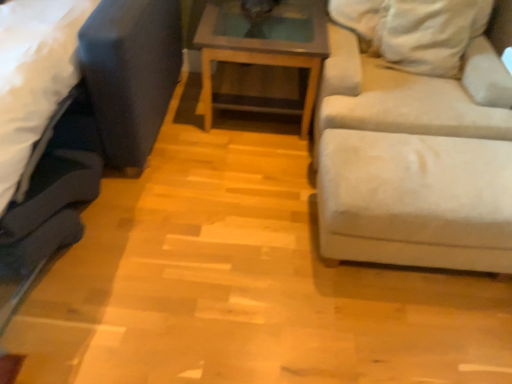
I want to click on velvet dark blue studio couch at left, the 2th studio couch positioned from the right, so click(x=93, y=134).

Where is `velvet dark blue studio couch at left, the 2th studio couch positioned from the right`? The height and width of the screenshot is (384, 512). velvet dark blue studio couch at left, the 2th studio couch positioned from the right is located at coordinates (93, 134).

From the image's perspective, is velvet dark blue studio couch at left, acting as the first studio couch starting from the left, located above or below beige fabric couch at right, positioned as the first studio couch in right-to-left order?

From the image's perspective, velvet dark blue studio couch at left, acting as the first studio couch starting from the left, appears below beige fabric couch at right, positioned as the first studio couch in right-to-left order.

Is velvet dark blue studio couch at left, the 2th studio couch positioned from the right, facing towards beige fabric couch at right, which is counted as the 2th studio couch, starting from the left?

No, velvet dark blue studio couch at left, the 2th studio couch positioned from the right, is not aimed at beige fabric couch at right, which is counted as the 2th studio couch, starting from the left.

Does velvet dark blue studio couch at left, the 2th studio couch positioned from the right, lie in front of beige fabric couch at right, positioned as the first studio couch in right-to-left order?

Yes, the depth of velvet dark blue studio couch at left, the 2th studio couch positioned from the right, is less than that of beige fabric couch at right, positioned as the first studio couch in right-to-left order.

From a real-world perspective, which is physically below, velvet dark blue studio couch at left, acting as the first studio couch starting from the left, or beige fabric couch at right, which is counted as the 2th studio couch, starting from the left?

From a 3D spatial view, velvet dark blue studio couch at left, acting as the first studio couch starting from the left, is below.

How many degrees apart are the facing directions of wooden glass top table at center and beige fabric couch at right, which is counted as the 2th studio couch, starting from the left?

The angular difference between wooden glass top table at center and beige fabric couch at right, which is counted as the 2th studio couch, starting from the left, is 1.61 degrees.

Which studio couch is the 1st one when counting from the front of the wooden glass top table at center? Please provide its 2D coordinates.

[(416, 169)]

Considering the relative sizes of wooden glass top table at center and beige fabric couch at right, which is counted as the 2th studio couch, starting from the left, in the image provided, is wooden glass top table at center bigger than beige fabric couch at right, which is counted as the 2th studio couch, starting from the left,?

No, wooden glass top table at center is not bigger than beige fabric couch at right, which is counted as the 2th studio couch, starting from the left.

Are wooden glass top table at center and beige fabric couch at right, which is counted as the 2th studio couch, starting from the left, located far from each other?

No, wooden glass top table at center is in close proximity to beige fabric couch at right, which is counted as the 2th studio couch, starting from the left.

Considering the relative sizes of wooden glass top table at center and velvet dark blue studio couch at left, the 2th studio couch positioned from the right, in the image provided, is wooden glass top table at center shorter than velvet dark blue studio couch at left, the 2th studio couch positioned from the right,?

Yes.

Which of these two, wooden glass top table at center or velvet dark blue studio couch at left, acting as the first studio couch starting from the left, is bigger?

velvet dark blue studio couch at left, acting as the first studio couch starting from the left, is bigger.

Is wooden glass top table at center to the right of velvet dark blue studio couch at left, acting as the first studio couch starting from the left, from the viewer's perspective?

Yes, wooden glass top table at center is to the right of velvet dark blue studio couch at left, acting as the first studio couch starting from the left.

Based on the photo, from the image's perspective, between wooden glass top table at center and velvet dark blue studio couch at left, the 2th studio couch positioned from the right, which one is located above?

wooden glass top table at center is shown above in the image.

Find the location of a particular element. studio couch that is the 1st object located below the wooden glass top table at center (from the image's perspective) is located at coordinates (416, 169).

Are beige fabric couch at right, which is counted as the 2th studio couch, starting from the left, and wooden glass top table at center located far from each other?

No, beige fabric couch at right, which is counted as the 2th studio couch, starting from the left, is in close proximity to wooden glass top table at center.

In the scene shown: Is beige fabric couch at right, positioned as the first studio couch in right-to-left order, smaller than wooden glass top table at center?

No.

Which is in front, point (507, 236) or point (228, 1)?

The point (507, 236) is more forward.

Considering the sizes of objects beige fabric couch at right, positioned as the first studio couch in right-to-left order, and velvet dark blue studio couch at left, acting as the first studio couch starting from the left, in the image provided, who is taller, beige fabric couch at right, positioned as the first studio couch in right-to-left order, or velvet dark blue studio couch at left, acting as the first studio couch starting from the left,?

beige fabric couch at right, positioned as the first studio couch in right-to-left order.

Considering the sizes of objects beige fabric couch at right, positioned as the first studio couch in right-to-left order, and velvet dark blue studio couch at left, acting as the first studio couch starting from the left, in the image provided, who is bigger, beige fabric couch at right, positioned as the first studio couch in right-to-left order, or velvet dark blue studio couch at left, acting as the first studio couch starting from the left,?

velvet dark blue studio couch at left, acting as the first studio couch starting from the left, is bigger.

Which is in front, point (382, 238) or point (52, 171)?

The point (382, 238) is in front.

Can you confirm if beige fabric couch at right, which is counted as the 2th studio couch, starting from the left, is thinner than velvet dark blue studio couch at left, the 2th studio couch positioned from the right?

Yes.

Consider the image. Between velvet dark blue studio couch at left, the 2th studio couch positioned from the right, and wooden glass top table at center, which one appears on the left side from the viewer's perspective?

From the viewer's perspective, velvet dark blue studio couch at left, the 2th studio couch positioned from the right, appears more on the left side.

Can you confirm if velvet dark blue studio couch at left, acting as the first studio couch starting from the left, is bigger than wooden glass top table at center?

Correct, velvet dark blue studio couch at left, acting as the first studio couch starting from the left, is larger in size than wooden glass top table at center.

Which object is more forward, velvet dark blue studio couch at left, the 2th studio couch positioned from the right, or wooden glass top table at center?

Positioned in front is velvet dark blue studio couch at left, the 2th studio couch positioned from the right.

Is wooden glass top table at center a part of velvet dark blue studio couch at left, acting as the first studio couch starting from the left?

That's incorrect, wooden glass top table at center is not inside velvet dark blue studio couch at left, acting as the first studio couch starting from the left.

Where is `studio couch behind the velvet dark blue studio couch at left, the 2th studio couch positioned from the right`? This screenshot has height=384, width=512. studio couch behind the velvet dark blue studio couch at left, the 2th studio couch positioned from the right is located at coordinates (416, 169).

Where is `table that appears below the beige fabric couch at right, which is counted as the 2th studio couch, starting from the left (from a real-world perspective)`? table that appears below the beige fabric couch at right, which is counted as the 2th studio couch, starting from the left (from a real-world perspective) is located at coordinates (263, 45).

Based on their spatial positions, is beige fabric couch at right, positioned as the first studio couch in right-to-left order, or wooden glass top table at center closer to velvet dark blue studio couch at left, acting as the first studio couch starting from the left?

wooden glass top table at center is positioned closer to the anchor velvet dark blue studio couch at left, acting as the first studio couch starting from the left.

From the image, which object appears to be farther from beige fabric couch at right, which is counted as the 2th studio couch, starting from the left, wooden glass top table at center or velvet dark blue studio couch at left, the 2th studio couch positioned from the right?

Among the two, velvet dark blue studio couch at left, the 2th studio couch positioned from the right, is located further to beige fabric couch at right, which is counted as the 2th studio couch, starting from the left.

Which object lies further to the anchor point wooden glass top table at center, velvet dark blue studio couch at left, the 2th studio couch positioned from the right, or beige fabric couch at right, positioned as the first studio couch in right-to-left order?

velvet dark blue studio couch at left, the 2th studio couch positioned from the right.

Which object lies further to the anchor point beige fabric couch at right, which is counted as the 2th studio couch, starting from the left, velvet dark blue studio couch at left, the 2th studio couch positioned from the right, or wooden glass top table at center?

The object further to beige fabric couch at right, which is counted as the 2th studio couch, starting from the left, is velvet dark blue studio couch at left, the 2th studio couch positioned from the right.

Based on their spatial positions, is wooden glass top table at center or beige fabric couch at right, positioned as the first studio couch in right-to-left order, closer to velvet dark blue studio couch at left, acting as the first studio couch starting from the left?

wooden glass top table at center is positioned closer to the anchor velvet dark blue studio couch at left, acting as the first studio couch starting from the left.

Which object lies nearer to the anchor point wooden glass top table at center, beige fabric couch at right, which is counted as the 2th studio couch, starting from the left, or velvet dark blue studio couch at left, the 2th studio couch positioned from the right?

beige fabric couch at right, which is counted as the 2th studio couch, starting from the left.

The image size is (512, 384). What are the coordinates of `table between velvet dark blue studio couch at left, acting as the first studio couch starting from the left, and beige fabric couch at right, which is counted as the 2th studio couch, starting from the left` in the screenshot? It's located at (263, 45).